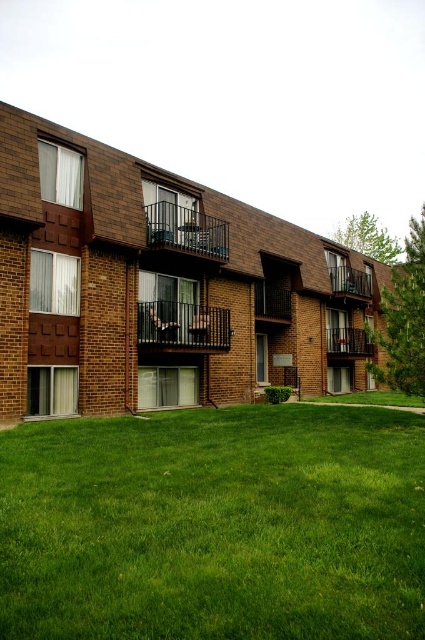
You are standing in front of the apartment complex and want to take a photo. You notice two points marked on the building. Which point is closer to your camera, point [209,346] or point [193,227]?

Point [209,346] is closer to the camera than point [193,227].

You are standing on the lawn in front of the apartment complex. You see the black metal balcony at center and the brown wooden balcony at upper right. Which balcony is higher up on the building?

The brown wooden balcony at upper right is higher up on the building because it is located above the black metal balcony at center.